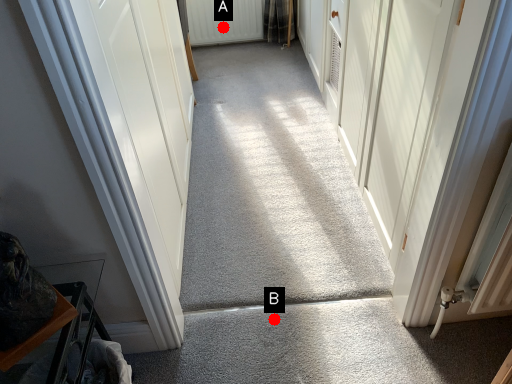
Question: Two points are circled on the image, labeled by A and B beside each circle. Which point appears closest to the camera in this image?

Choices:
 (A) A is closer
 (B) B is closer

Answer: (B)